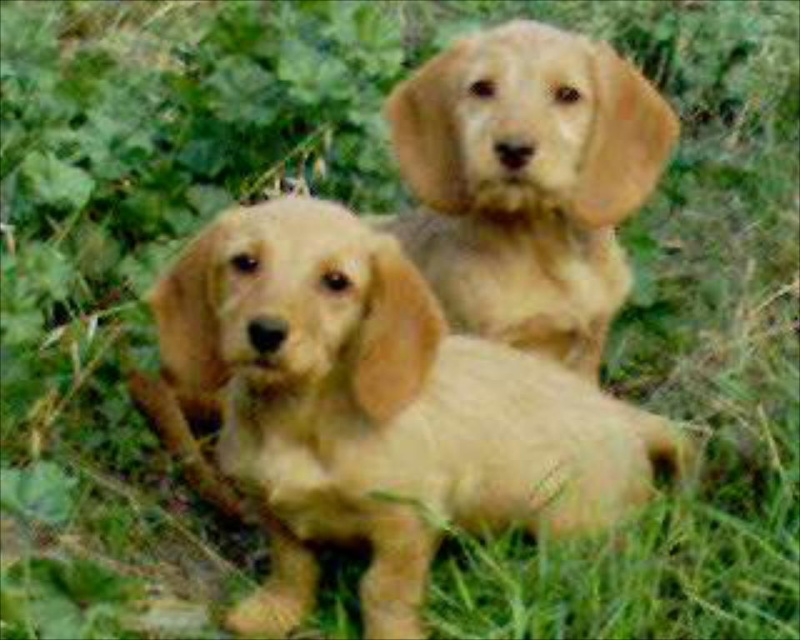
At what (x,y) coordinates should I click in order to perform the action: click on golden fur puppy at center. Please return your answer as a coordinate pair (x, y). The width and height of the screenshot is (800, 640). Looking at the image, I should click on (372, 410).

I want to click on golden fur puppy at center, so click(x=372, y=410).